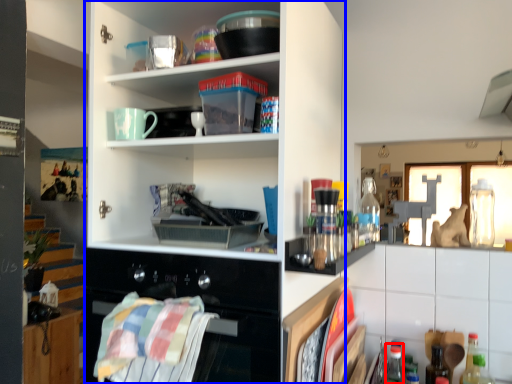
Question: Which of the following is the farthest to the observer, bottle (highlighted by a red box) or cupboard (highlighted by a blue box)?

Choices:
 (A) bottle
 (B) cupboard

Answer: (A)